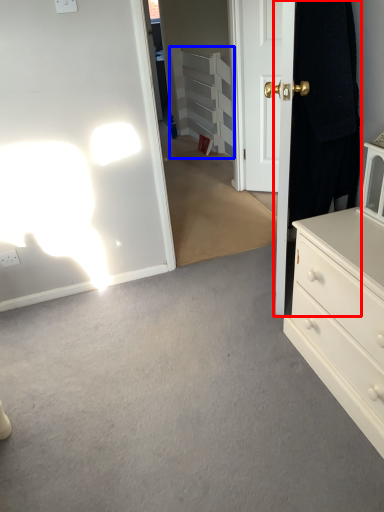
Question: Among these objects, which one is farthest to the camera, door (highlighted by a red box) or armoire (highlighted by a blue box)?

Choices:
 (A) door
 (B) armoire

Answer: (B)